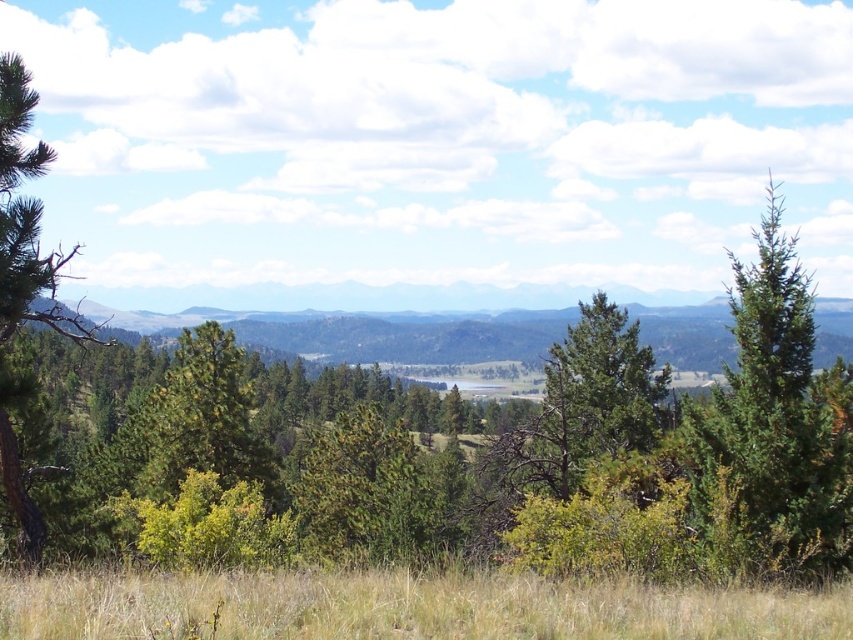
You are standing in the serene landscape and want to place a small flag at the point that is closer to you. Which point should you choose between point (526, 596) and point (33, 467)?

Point (33, 467) is closer to you because it is in the foreground compared to point (526, 596) which is behind it.